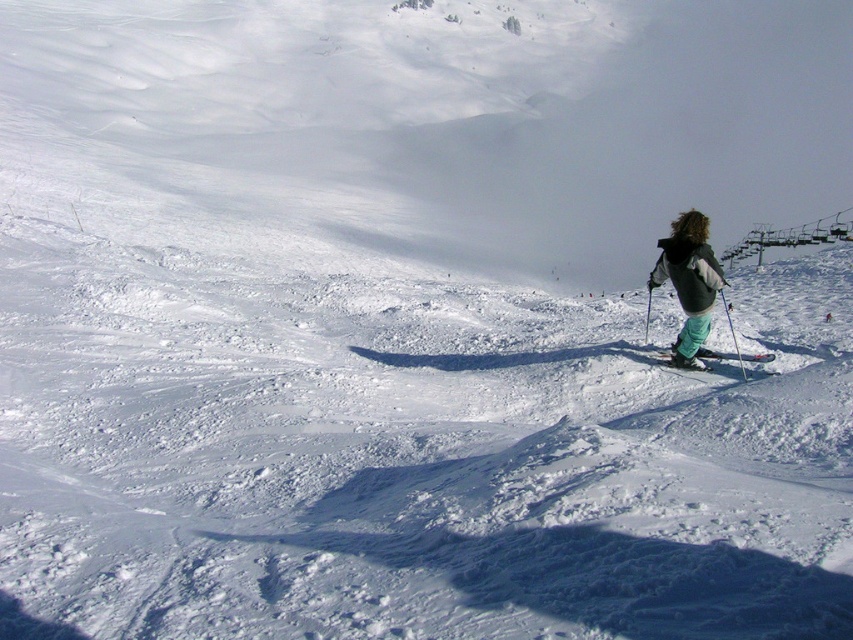
Is teal fabric pants at right taller than green fabric ski at center?

Correct, teal fabric pants at right is much taller as green fabric ski at center.

Which is in front, point (682, 268) or point (704, 356)?

Positioned in front is point (682, 268).

Is point (686, 230) more distant than point (700, 353)?

No.

What are the coordinates of `teal fabric pants at right` in the screenshot? It's located at (689, 282).

Between point (695, 268) and point (733, 253), which one is positioned in front?

Positioned in front is point (695, 268).

What do you see at coordinates (689, 282) in the screenshot? The height and width of the screenshot is (640, 853). I see `teal fabric pants at right` at bounding box center [689, 282].

Looking at this image, measure the distance between point [688,237] and camera.

They are 11.65 meters apart.

At what (x,y) coordinates should I click in order to perform the action: click on teal fabric pants at right. Please return your answer as a coordinate pair (x, y). The width and height of the screenshot is (853, 640). Looking at the image, I should click on (689, 282).

Is metallic gray ski lift at upper right behind green fabric ski at center?

Yes, metallic gray ski lift at upper right is further from the viewer.

What do you see at coordinates (790, 236) in the screenshot? I see `metallic gray ski lift at upper right` at bounding box center [790, 236].

The image size is (853, 640). Find the location of `metallic gray ski lift at upper right`. metallic gray ski lift at upper right is located at coordinates (790, 236).